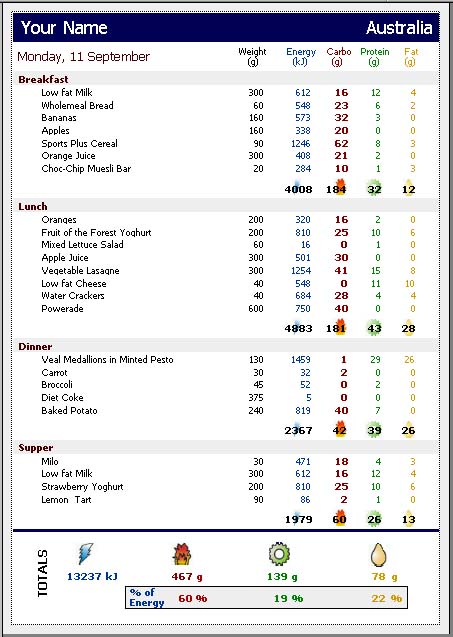
Identify the location of dark blue divider. The width and height of the screenshot is (453, 637). (235, 532).